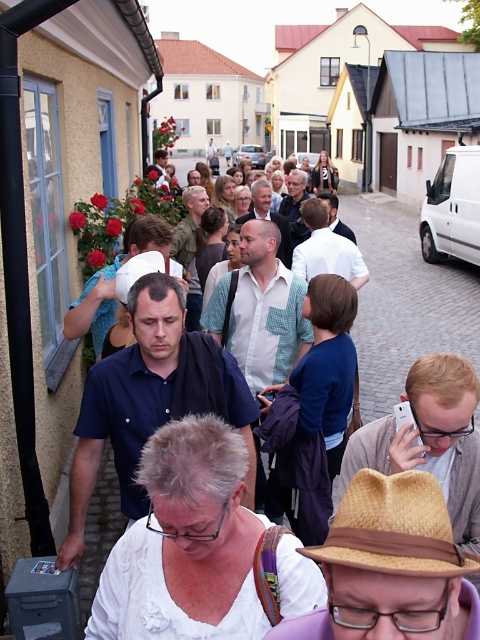
Question: Estimate the real-world distances between objects in this image. Which object is farther from the brown straw hat at lower center?

Choices:
 (A) white cotton shirt at center
 (B) straw hat at center

Answer: (A)

Question: Considering the real-world distances, which object is closest to the white cotton shirt at center?

Choices:
 (A) brown straw hat at lower center
 (B) straw hat at center

Answer: (A)

Question: Among these points, which one is farthest from the camera?

Choices:
 (A) (141, 260)
 (B) (443, 532)
 (C) (460, 304)

Answer: (C)

Question: Is brown straw hat at lower center bigger than straw hat at center?

Choices:
 (A) no
 (B) yes

Answer: (A)

Question: Observing the image, what is the correct spatial positioning of white cotton shirt at center in reference to straw hat at center?

Choices:
 (A) above
 (B) below

Answer: (A)

Question: Is white cotton shirt at center wider than straw hat at center?

Choices:
 (A) yes
 (B) no

Answer: (A)